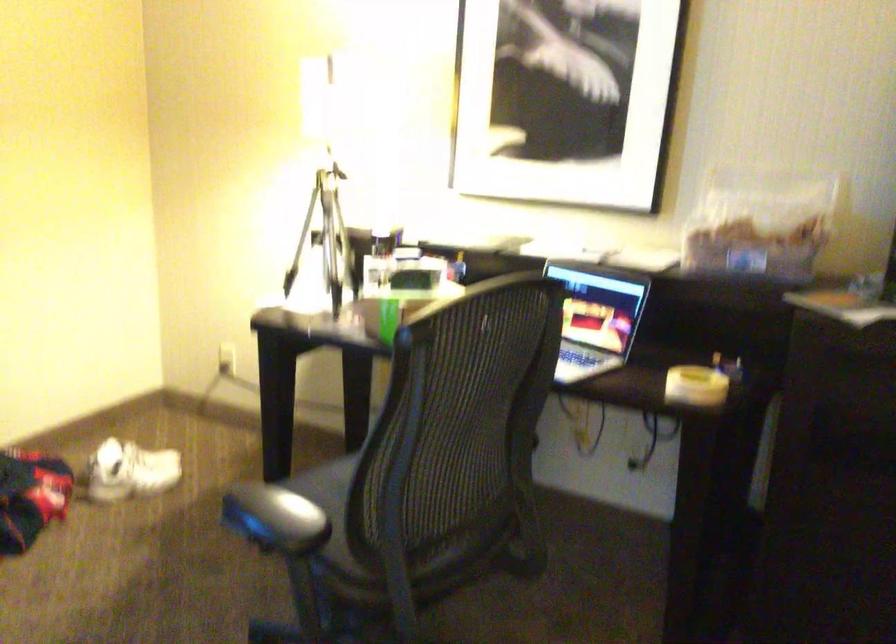
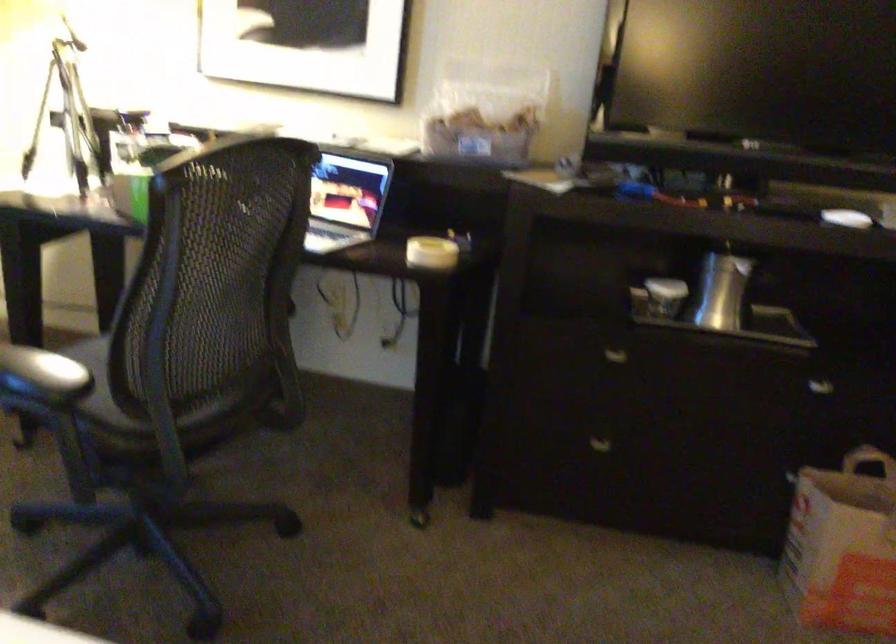
In the second image, find the point that corresponds to (x=695, y=384) in the first image.

(431, 252)